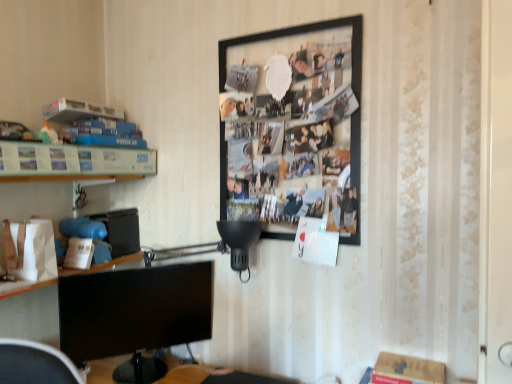
Question: Does black matte picture frame at upper center have a smaller size compared to metallic silver frame at left?

Choices:
 (A) no
 (B) yes

Answer: (A)

Question: Can we say black matte picture frame at upper center lies outside metallic silver frame at left?

Choices:
 (A) yes
 (B) no

Answer: (A)

Question: Is black matte picture frame at upper center further to camera compared to metallic silver frame at left?

Choices:
 (A) yes
 (B) no

Answer: (A)

Question: From a real-world perspective, is black matte picture frame at upper center positioned over metallic silver frame at left based on gravity?

Choices:
 (A) yes
 (B) no

Answer: (A)

Question: Considering the relative sizes of black matte picture frame at upper center and metallic silver frame at left in the image provided, is black matte picture frame at upper center bigger than metallic silver frame at left?

Choices:
 (A) no
 (B) yes

Answer: (B)

Question: From a real-world perspective, relative to black glossy monitor at lower left, is metallic silver frame at left vertically above or below?

Choices:
 (A) above
 (B) below

Answer: (A)

Question: Which is correct: metallic silver frame at left is inside black glossy monitor at lower left, or outside of it?

Choices:
 (A) outside
 (B) inside

Answer: (A)

Question: From the image's perspective, is metallic silver frame at left above or below black glossy monitor at lower left?

Choices:
 (A) below
 (B) above

Answer: (B)

Question: Is point (18, 163) positioned closer to the camera than point (207, 284)?

Choices:
 (A) farther
 (B) closer

Answer: (B)

Question: Is point click(346, 150) closer or farther from the camera than point click(41, 145)?

Choices:
 (A) farther
 (B) closer

Answer: (A)

Question: Looking at the image, does black matte picture frame at upper center seem bigger or smaller compared to metallic silver frame at left?

Choices:
 (A) big
 (B) small

Answer: (A)

Question: Would you say black matte picture frame at upper center is inside or outside metallic silver frame at left?

Choices:
 (A) inside
 (B) outside

Answer: (B)

Question: From their relative heights in the image, would you say black matte picture frame at upper center is taller or shorter than metallic silver frame at left?

Choices:
 (A) short
 (B) tall

Answer: (B)

Question: Is point (351, 226) positioned closer to the camera than point (163, 319)?

Choices:
 (A) closer
 (B) farther

Answer: (A)

Question: In the image, is black matte picture frame at upper center on the left side or the right side of black glossy monitor at lower left?

Choices:
 (A) left
 (B) right

Answer: (B)